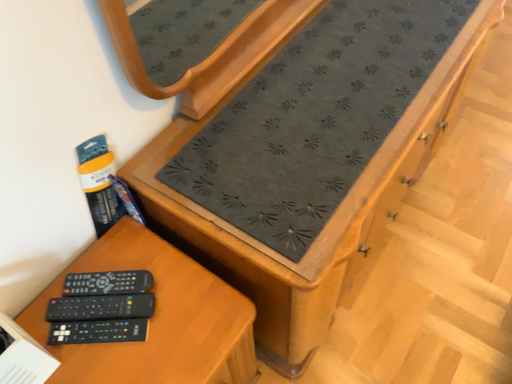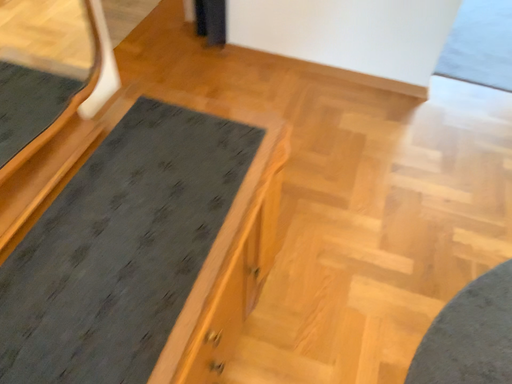
Question: Which way did the camera rotate in the video?

Choices:
 (A) rotated left
 (B) rotated right

Answer: (B)